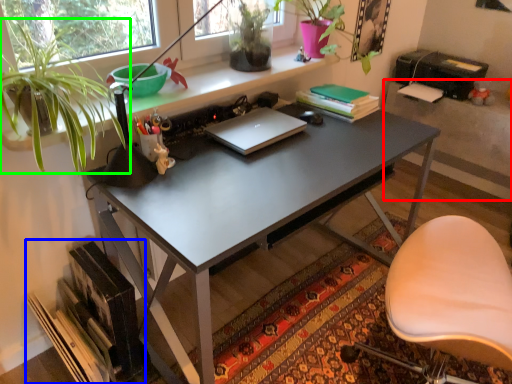
Question: Which is farther away from table (highlighted by a red box)? book (highlighted by a blue box) or houseplant (highlighted by a green box)?

Choices:
 (A) book
 (B) houseplant

Answer: (A)